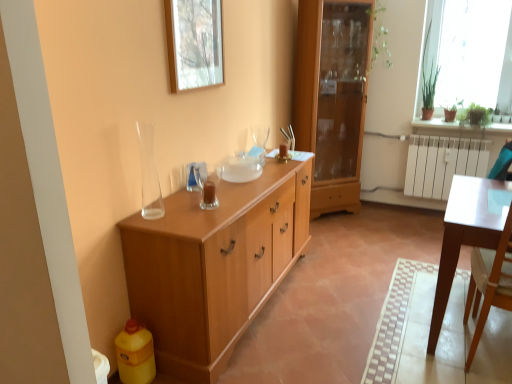
Question: Is white glossy table at right closer to camera compared to light brown wood cabinet at center?

Choices:
 (A) no
 (B) yes

Answer: (B)

Question: Can you confirm if white glossy table at right is bigger than light brown wood cabinet at center?

Choices:
 (A) yes
 (B) no

Answer: (B)

Question: Is white glossy table at right positioned beyond the bounds of light brown wood cabinet at center?

Choices:
 (A) yes
 (B) no

Answer: (A)

Question: Is white glossy table at right far away from light brown wood cabinet at center?

Choices:
 (A) yes
 (B) no

Answer: (A)

Question: Can you confirm if white glossy table at right is positioned to the left of light brown wood cabinet at center?

Choices:
 (A) yes
 (B) no

Answer: (B)

Question: From the image's perspective, does white glossy table at right appear lower than light brown wood cabinet at center?

Choices:
 (A) yes
 (B) no

Answer: (A)

Question: Is transparent glass vase at left facing towards translucent glass candle at center?

Choices:
 (A) no
 (B) yes

Answer: (A)

Question: From the image's perspective, is transparent glass vase at left beneath translucent glass candle at center?

Choices:
 (A) no
 (B) yes

Answer: (A)

Question: Considering the relative positions of transparent glass vase at left and translucent glass candle at center in the image provided, is transparent glass vase at left to the right of translucent glass candle at center from the viewer's perspective?

Choices:
 (A) no
 (B) yes

Answer: (A)

Question: Is transparent glass vase at left wider than translucent glass candle at center?

Choices:
 (A) yes
 (B) no

Answer: (A)

Question: From a real-world perspective, is transparent glass vase at left over translucent glass candle at center?

Choices:
 (A) yes
 (B) no

Answer: (A)

Question: Is transparent glass vase at left bigger than translucent glass candle at center?

Choices:
 (A) no
 (B) yes

Answer: (B)

Question: Is light brown wood cabinet at center oriented towards wooden picture frame at upper center?

Choices:
 (A) no
 (B) yes

Answer: (A)